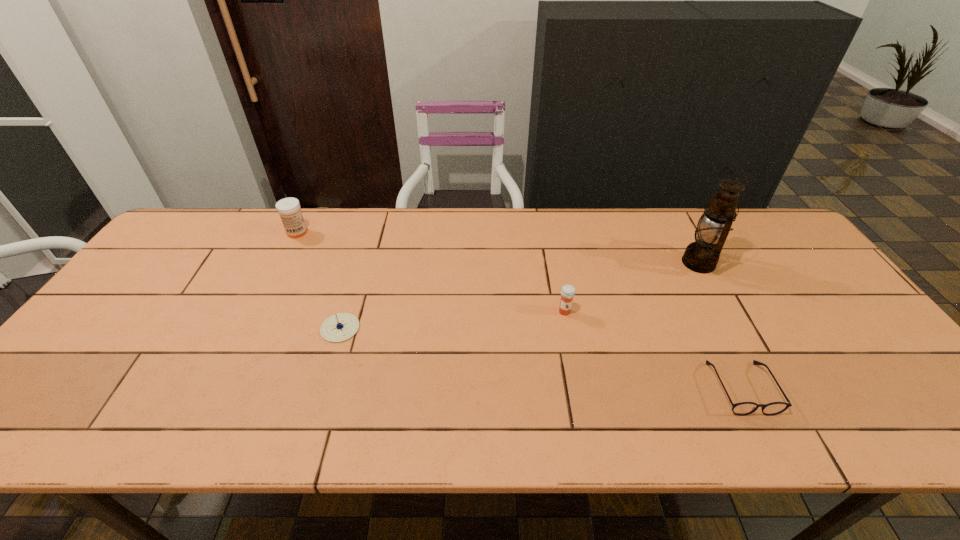
You are a GUI agent. You are given a task and a screenshot of the screen. Output one action in this format:
    pyautogui.click(x=<x>, y=<y>)
    Task: Click on the vacant space that is in between the oil lamp and the compass
    
    Given the screenshot: What is the action you would take?
    pyautogui.click(x=519, y=295)

Image resolution: width=960 pixels, height=540 pixels. Identify the location of free spot between the nearest object and the fourth nearest object. (720, 325).

Where is `free space between the second farthest object and the nearest object`? Image resolution: width=960 pixels, height=540 pixels. free space between the second farthest object and the nearest object is located at coordinates (720, 325).

Identify the location of unoccupied area between the taller medicine and the third tallest object. (431, 272).

Where is `blank region between the third tallest object and the nearest object`? blank region between the third tallest object and the nearest object is located at coordinates (653, 350).

The image size is (960, 540). Identify the location of blank region between the nearest object and the right medicine. (653, 350).

Locate an element on the screen. This screenshot has width=960, height=540. unoccupied area between the nearest object and the third object from left to right is located at coordinates (653, 350).

I want to click on empty space that is in between the taller medicine and the spectacles, so click(519, 310).

Identify the location of vacant space in between the fourth shortest object and the tallest object. (497, 247).

Image resolution: width=960 pixels, height=540 pixels. Identify the location of free space between the spectacles and the farthest object. (519, 310).